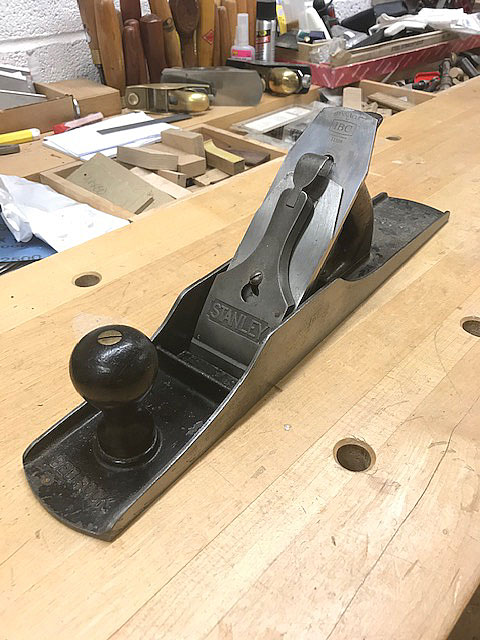
Where is `wooden work bench`? The width and height of the screenshot is (480, 640). wooden work bench is located at coordinates (423, 408), (24, 396), (147, 601), (464, 143).